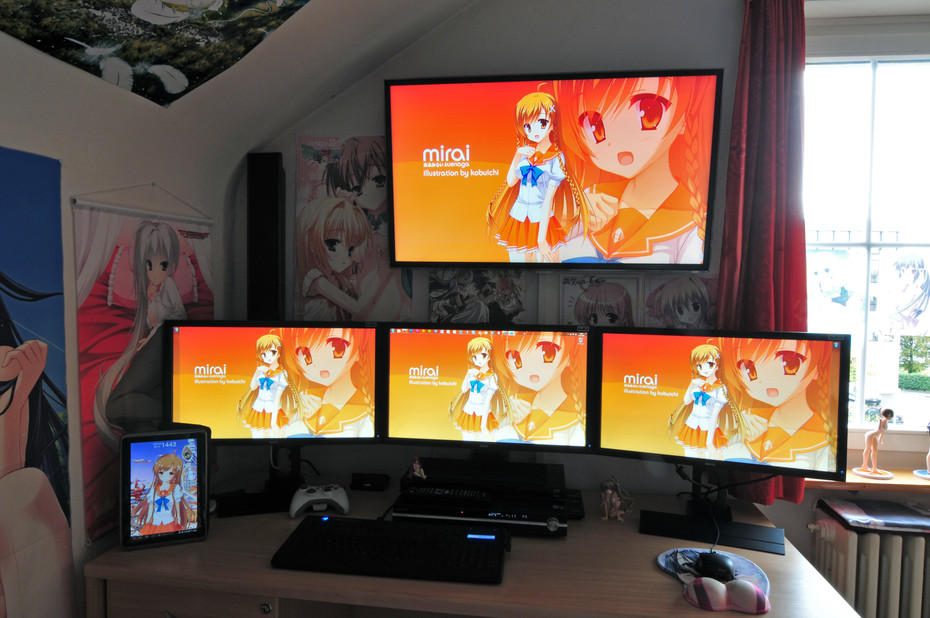
Locate an element on the screen. window is located at coordinates (865, 161).